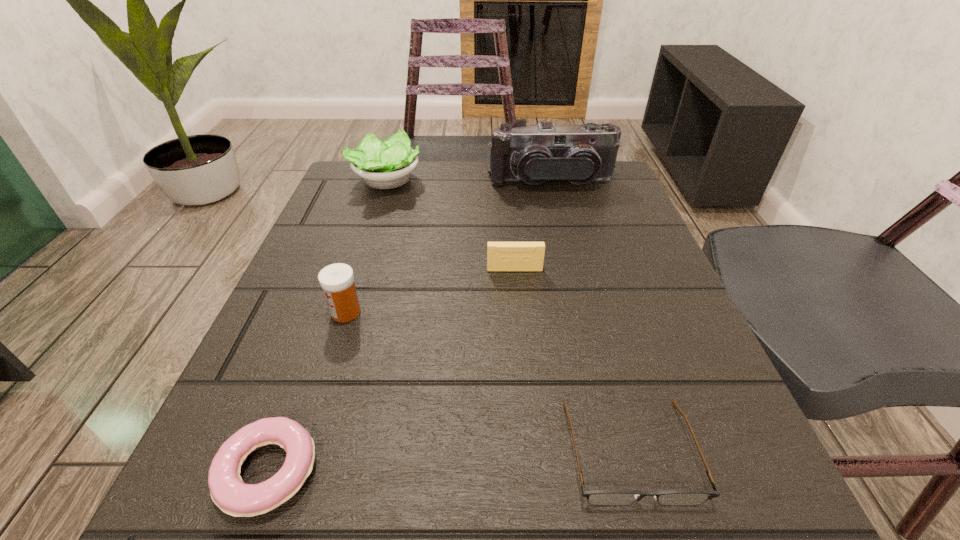
The image size is (960, 540). I want to click on camcorder, so click(x=545, y=153).

The width and height of the screenshot is (960, 540). I want to click on lettuce, so click(x=387, y=164).

Where is `medicine`? This screenshot has height=540, width=960. medicine is located at coordinates (337, 280).

You are a GUI agent. You are given a task and a screenshot of the screen. Output one action in this format:
    pyautogui.click(x=<x>, y=<y>)
    Task: Click on the videotape
    
    Given the screenshot: What is the action you would take?
    pyautogui.click(x=501, y=256)

Identify the location of the fourth nearest object. Image resolution: width=960 pixels, height=540 pixels. (501, 256).

The width and height of the screenshot is (960, 540). I want to click on spectacles, so pyautogui.click(x=595, y=497).

You are a GUI agent. You are given a task and a screenshot of the screen. Output one action in this format:
    pyautogui.click(x=<x>, y=<y>)
    Task: Click on the doughnut
    Image resolution: width=960 pixels, height=540 pixels.
    Given the screenshot: What is the action you would take?
    pyautogui.click(x=234, y=497)

The width and height of the screenshot is (960, 540). What are the coordinates of `vacant space located 0.370m on the front-facing side of the tallest object` in the screenshot? It's located at (583, 313).

Find the location of a particular element. This screenshot has height=540, width=960. vacant space located 0.210m on the right of the lettuce is located at coordinates (514, 181).

The width and height of the screenshot is (960, 540). I want to click on vacant space located on the front of the third nearest object, so click(274, 539).